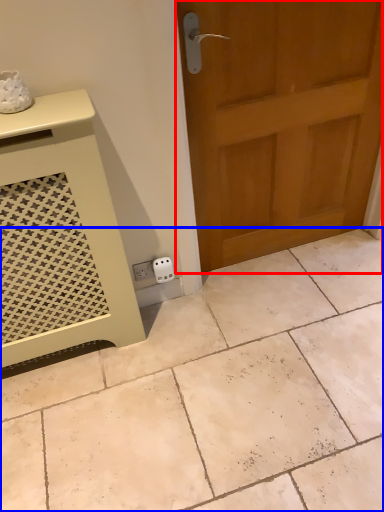
Question: Which of the following is the farthest to the observer, door (highlighted by a red box) or ceramic tile (highlighted by a blue box)?

Choices:
 (A) door
 (B) ceramic tile

Answer: (A)